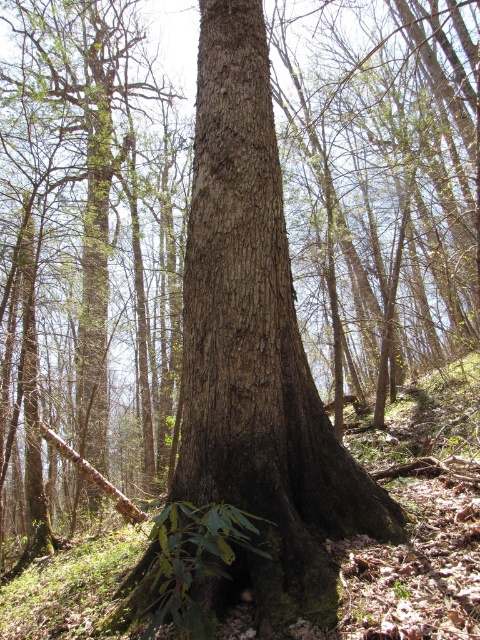
Question: Does brown rough tree trunk at center have a smaller size compared to smooth brown tree trunk at center?

Choices:
 (A) yes
 (B) no

Answer: (A)

Question: Which of the following is the closest to the observer?

Choices:
 (A) smooth brown tree trunk at center
 (B) brown rough tree trunk at center

Answer: (B)

Question: Does brown rough tree trunk at center appear under smooth brown tree trunk at center?

Choices:
 (A) yes
 (B) no

Answer: (A)

Question: Can you confirm if brown rough tree trunk at center is positioned below smooth brown tree trunk at center?

Choices:
 (A) no
 (B) yes

Answer: (B)

Question: Among these points, which one is nearest to the camera?

Choices:
 (A) (96, 109)
 (B) (260, 209)

Answer: (B)

Question: Which point appears farthest from the camera in this image?

Choices:
 (A) (212, 449)
 (B) (104, 16)

Answer: (B)